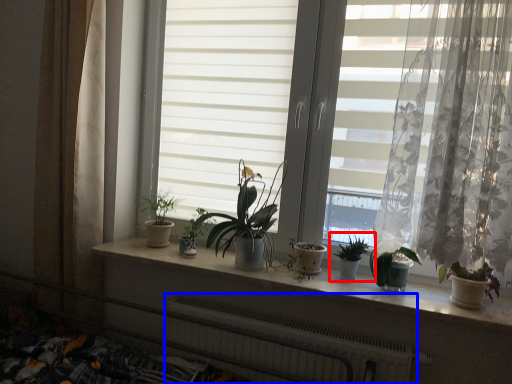
Question: Which object is further to the camera taking this photo, houseplant (highlighted by a red box) or radiator (highlighted by a blue box)?

Choices:
 (A) houseplant
 (B) radiator

Answer: (A)